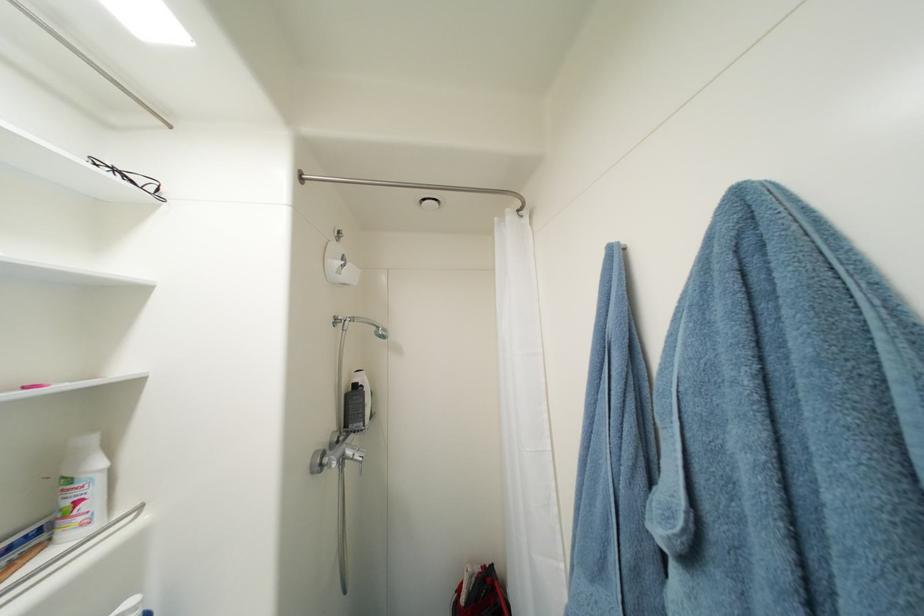
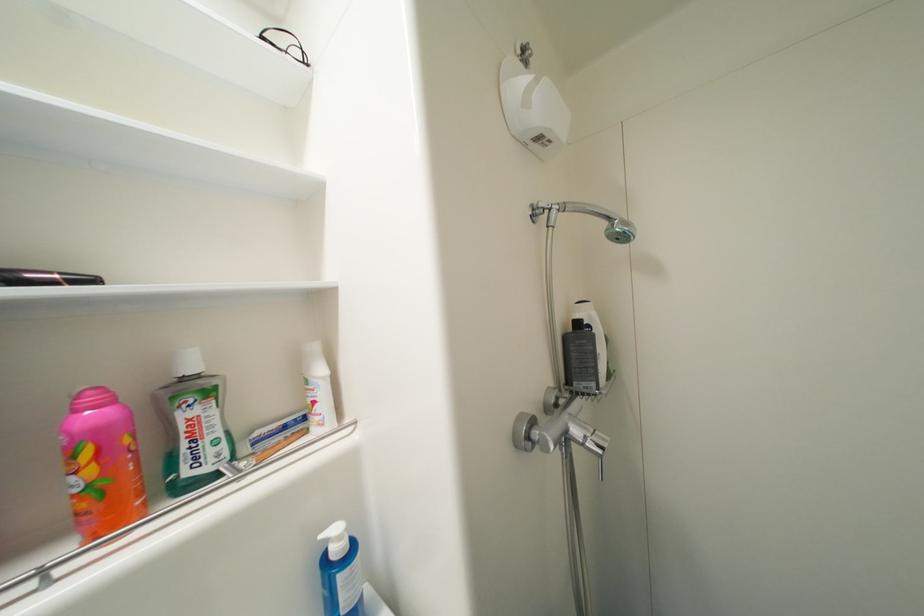
Question: The camera is either moving clockwise (left) or counter-clockwise (right) around the object. The first image is from the beginning of the video and the second image is from the end. Is the camera moving left or right when shooting the video?

Choices:
 (A) Left
 (B) Right

Answer: (B)